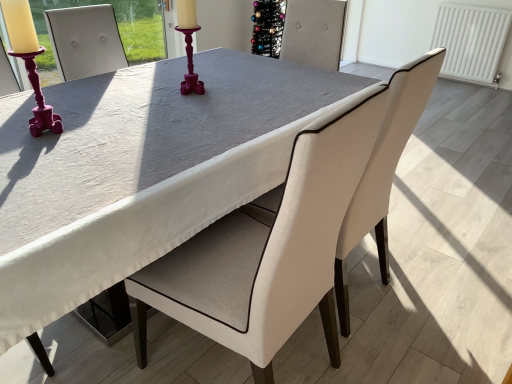
I want to click on free spot behind matte pink candlestick at left, so click(x=80, y=114).